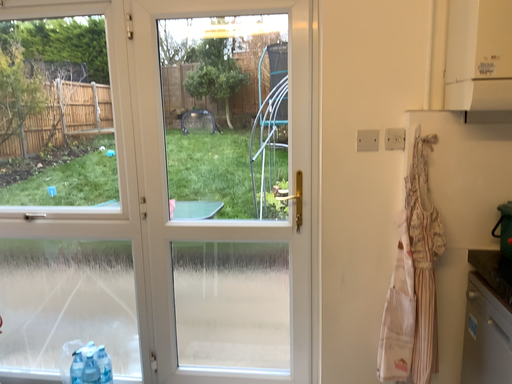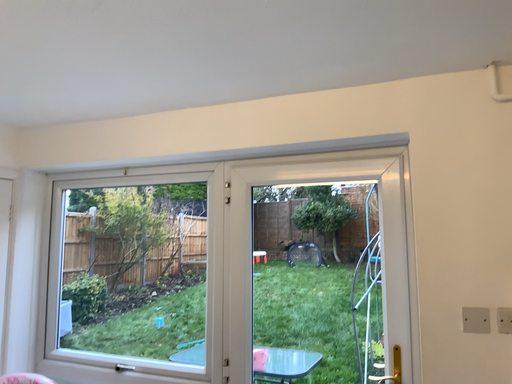
Question: How did the camera likely rotate when shooting the video?

Choices:
 (A) rotated downward
 (B) rotated upward

Answer: (B)